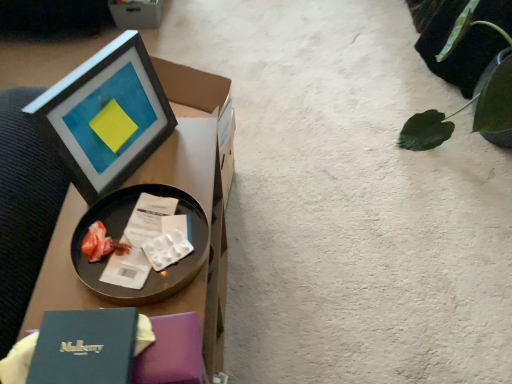
You are a GUI agent. You are given a task and a screenshot of the screen. Output one action in this format:
    pyautogui.click(x=<x>, y=<y>)
    Task: Click on the free space between matte black picture frame at upper left and metallic tray at left
    This screenshot has height=384, width=512.
    Given the screenshot: What is the action you would take?
    pyautogui.click(x=148, y=190)